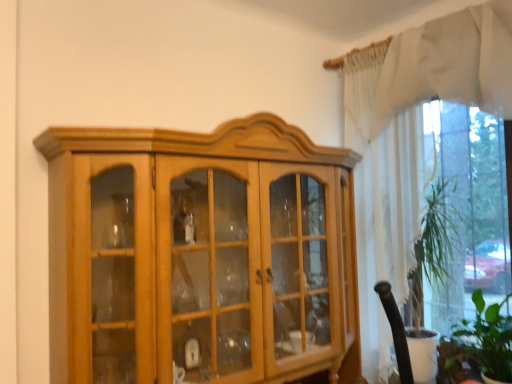
Question: From their relative heights in the image, would you say light brown wood cabinet at center is taller or shorter than white sheer curtain at upper right, which ranks as the first curtain in top-to-bottom order?

Choices:
 (A) tall
 (B) short

Answer: (A)

Question: Considering the positions of light brown wood cabinet at center and white sheer curtain at upper right, arranged as the second curtain when ordered from the bottom, in the image, is light brown wood cabinet at center wider or thinner than white sheer curtain at upper right, arranged as the second curtain when ordered from the bottom,?

Choices:
 (A) thin
 (B) wide

Answer: (B)

Question: Estimate the real-world distances between objects in this image. Which object is closer to the white sheer curtain at upper right, arranged as the second curtain when ordered from the bottom?

Choices:
 (A) green leafy plant at lower right
 (B) white sheer curtain at upper right, arranged as the 1th curtain when ordered from the bottom
 (C) light brown wood cabinet at center

Answer: (B)

Question: Considering the real-world distances, which object is farthest from the light brown wood cabinet at center?

Choices:
 (A) white sheer curtain at upper right, which ranks as the first curtain in top-to-bottom order
 (B) white sheer curtain at upper right, arranged as the second curtain when viewed from the top
 (C) green leafy plant at lower right

Answer: (C)